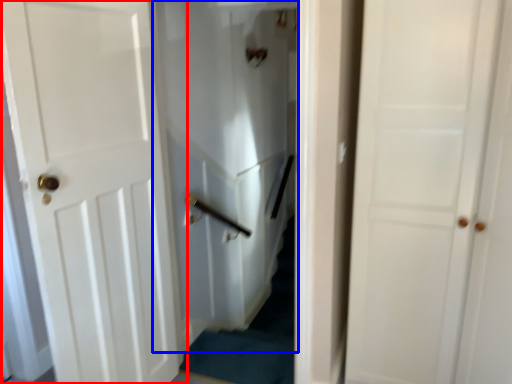
Question: Which object is closer to the camera taking this photo, door (highlighted by a red box) or elevator (highlighted by a blue box)?

Choices:
 (A) door
 (B) elevator

Answer: (A)